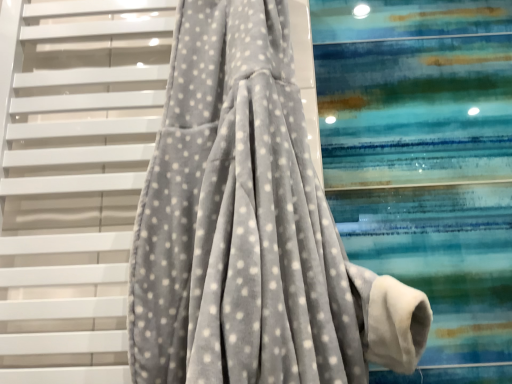
Question: From the image's perspective, is gray velvety fabric at center positioned above or below velvet grey robe at center?

Choices:
 (A) above
 (B) below

Answer: (B)

Question: Considering the positions of gray velvety fabric at center and velvet grey robe at center in the image, is gray velvety fabric at center bigger or smaller than velvet grey robe at center?

Choices:
 (A) big
 (B) small

Answer: (B)

Question: Is gray velvety fabric at center spatially inside velvet grey robe at center, or outside of it?

Choices:
 (A) outside
 (B) inside

Answer: (A)

Question: Based on their sizes in the image, would you say velvet grey robe at center is bigger or smaller than gray velvety fabric at center?

Choices:
 (A) small
 (B) big

Answer: (B)

Question: Is velvet grey robe at center inside the boundaries of gray velvety fabric at center, or outside?

Choices:
 (A) outside
 (B) inside

Answer: (A)

Question: From the image's perspective, is velvet grey robe at center located above or below gray velvety fabric at center?

Choices:
 (A) above
 (B) below

Answer: (A)

Question: Considering the positions of velvet grey robe at center and gray velvety fabric at center in the image, is velvet grey robe at center taller or shorter than gray velvety fabric at center?

Choices:
 (A) tall
 (B) short

Answer: (B)